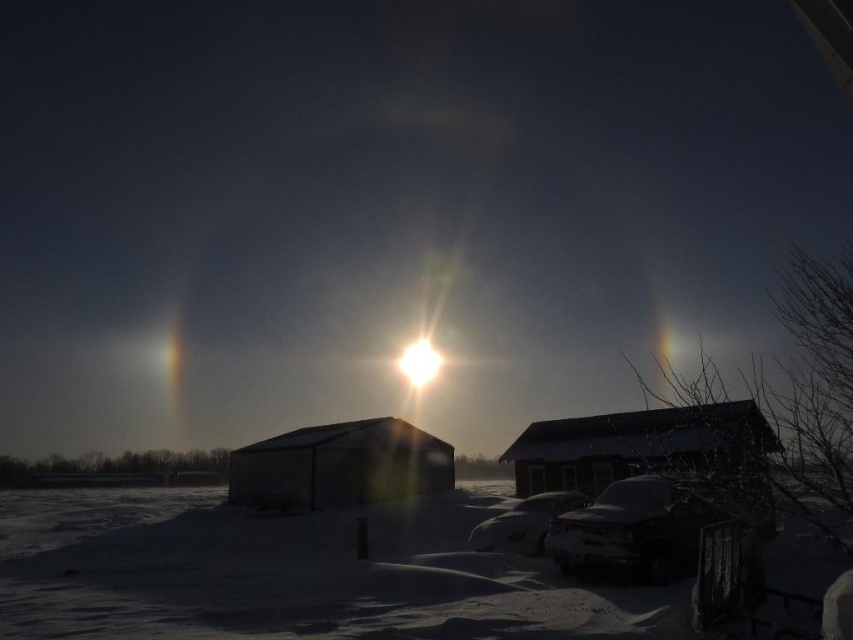
Can you confirm if white frosty car at lower right is wider than white glossy car at lower center?

Incorrect, white frosty car at lower right's width does not surpass white glossy car at lower center's.

Can you confirm if white frosty car at lower right is smaller than white glossy car at lower center?

Correct, white frosty car at lower right occupies less space than white glossy car at lower center.

Which is behind, point (666, 484) or point (474, 545)?

The point (474, 545) is more distant.

Locate an element on the screen. white frosty car at lower right is located at coordinates (641, 525).

Who is more forward, (x=387, y=484) or (x=531, y=532)?

Point (x=531, y=532)

Does dark gray matte barn at center appear under white glossy car at lower center?

Yes.

What are the coordinates of `dark gray matte barn at center` in the screenshot? It's located at point(340,465).

This screenshot has height=640, width=853. In order to click on dark gray matte barn at center in this screenshot , I will do `click(340, 465)`.

Can you confirm if red wooden barn at center is positioned below dark gray matte barn at center?

Actually, red wooden barn at center is above dark gray matte barn at center.

Between red wooden barn at center and dark gray matte barn at center, which one appears on the left side from the viewer's perspective?

dark gray matte barn at center is more to the left.

Does point (751, 438) come in front of point (316, 444)?

That is True.

Identify the location of red wooden barn at center. (637, 445).